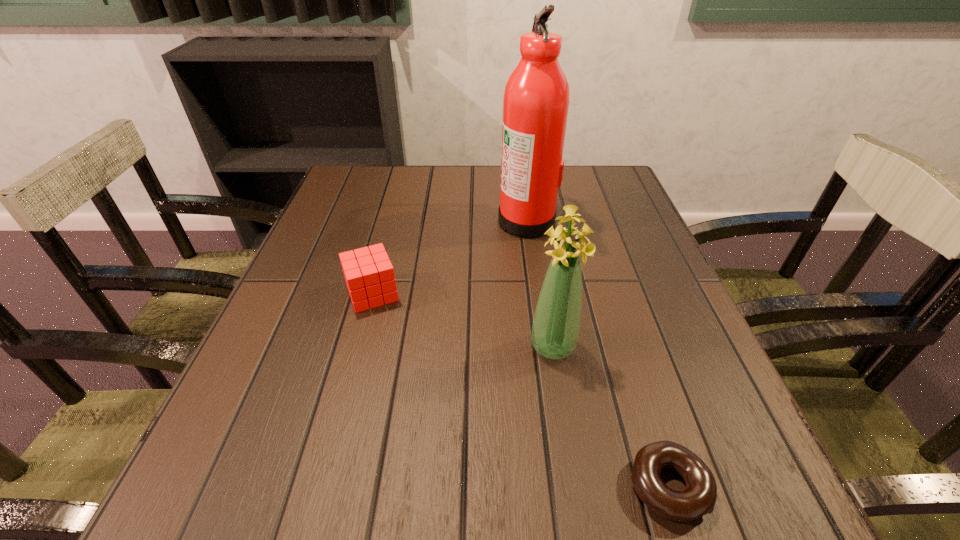
The height and width of the screenshot is (540, 960). Find the location of `free area in between the doughnut and the leftmost object`. free area in between the doughnut and the leftmost object is located at coordinates (519, 390).

The width and height of the screenshot is (960, 540). In order to click on free space between the second nearest object and the nearest object in this screenshot , I will do `click(610, 416)`.

Where is `vacant area that lies between the third nearest object and the rightmost object`? Image resolution: width=960 pixels, height=540 pixels. vacant area that lies between the third nearest object and the rightmost object is located at coordinates (519, 390).

Identify the location of free space between the doughnut and the third tallest object. (519, 390).

Identify the location of vacant region between the farthest object and the doughnut. Image resolution: width=960 pixels, height=540 pixels. (597, 353).

Where is `object that is the second closest to the bouquet`? object that is the second closest to the bouquet is located at coordinates (369, 275).

Identify which object is located as the second nearest to the third farthest object. Please provide its 2D coordinates. Your answer should be formatted as a tuple, i.e. [(x, y)], where the tuple contains the x and y coordinates of a point satisfying the conditions above.

[(369, 275)]

At what (x,y) coordinates should I click in order to perform the action: click on vacant space that satisfies the following two spatial constraints: 1. on the front-facing side of the bouquet; 2. on the right side of the rightmost object. Please return your answer as a coordinate pair (x, y). The width and height of the screenshot is (960, 540). Looking at the image, I should click on (575, 486).

I want to click on vacant space that satisfies the following two spatial constraints: 1. on the label side of the farthest object; 2. on the back side of the rightmost object, so click(x=564, y=486).

Find the location of a particular element. blank area in the image that satisfies the following two spatial constraints: 1. on the front-facing side of the second nearest object; 2. on the right side of the doughnut is located at coordinates (575, 486).